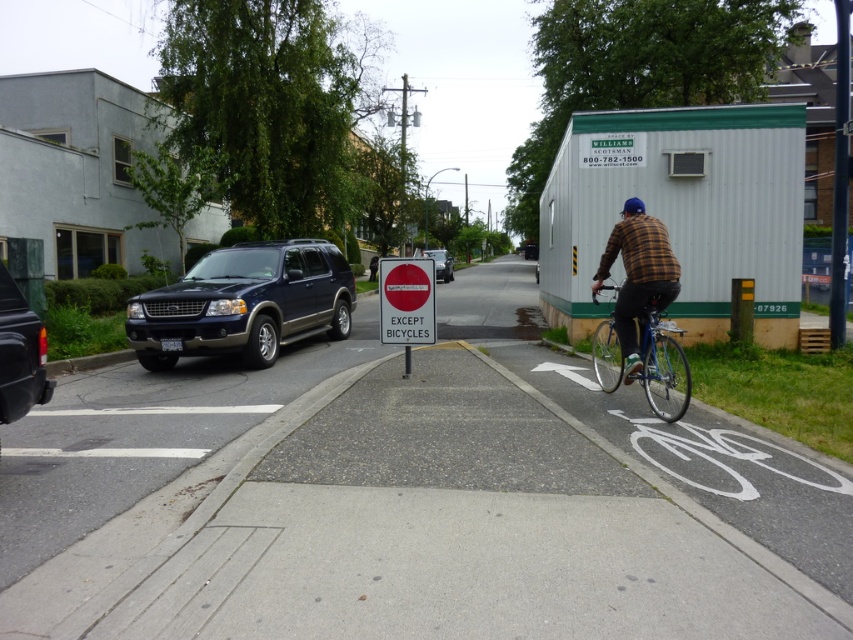
Which is below, red plastic sign at center or matte black suv at center?

red plastic sign at center

Is point (387, 337) positioned after point (445, 278)?

That is False.

Is point (381, 308) less distant than point (428, 250)?

Yes, it is in front of point (428, 250).

Identify the location of red plastic sign at center. (405, 301).

Is shiny metallic bicycle at right closer to the viewer compared to matte black suv at center?

That is True.

Locate an element on the screen. The image size is (853, 640). shiny metallic bicycle at right is located at coordinates (645, 362).

The width and height of the screenshot is (853, 640). Find the location of `shiny metallic bicycle at right`. shiny metallic bicycle at right is located at coordinates (645, 362).

Based on the photo, between shiny dark blue suv at left and matte black suv at center, which one is positioned lower?

shiny dark blue suv at left is lower down.

Which of these two, shiny dark blue suv at left or matte black suv at center, stands shorter?

shiny dark blue suv at left

Between point (318, 291) and point (444, 266), which one is positioned in front?

Positioned in front is point (318, 291).

Where is `shiny dark blue suv at left`? shiny dark blue suv at left is located at coordinates (244, 304).